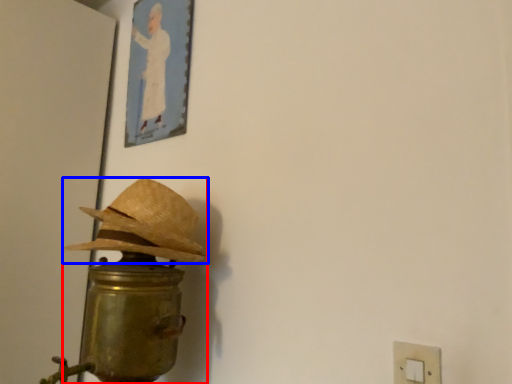
Question: Which point is further to the camera, table lamp (highlighted by a red box) or hat (highlighted by a blue box)?

Choices:
 (A) table lamp
 (B) hat

Answer: (B)